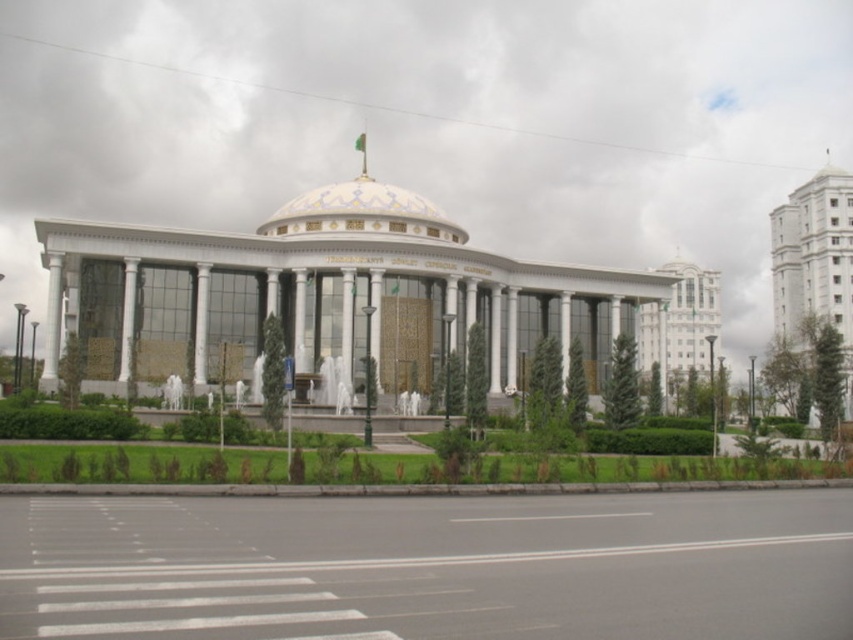
Who is positioned more to the left, white marble building at right or white glossy building at upper right?

Positioned to the left is white glossy building at upper right.

Which is in front, point (824, 216) or point (647, 364)?

Positioned in front is point (824, 216).

Is point (840, 273) positioned after point (676, 282)?

Yes.

Locate an element on the screen. The height and width of the screenshot is (640, 853). white marble building at right is located at coordinates (815, 260).

This screenshot has height=640, width=853. Find the location of `white marble building at right`. white marble building at right is located at coordinates (815, 260).

Who is more forward, (785, 323) or (432, 212)?

Point (432, 212)

The width and height of the screenshot is (853, 640). Find the location of `white marble building at right`. white marble building at right is located at coordinates (815, 260).

Which is more to the right, white marble palace at center or white marble building at right?

From the viewer's perspective, white marble building at right appears more on the right side.

In order to click on white marble palace at center in this screenshot , I will do `click(322, 292)`.

What do you see at coordinates (322, 292) in the screenshot? This screenshot has width=853, height=640. I see `white marble palace at center` at bounding box center [322, 292].

Locate an element on the screen. white marble palace at center is located at coordinates (322, 292).